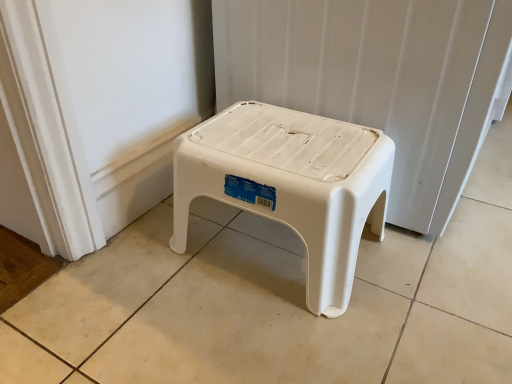
Find the location of a particular element. The image size is (512, 384). white plastic stool at center is located at coordinates (291, 185).

Describe the element at coordinates (291, 185) in the screenshot. I see `white plastic stool at center` at that location.

What is the approximate height of white plastic stool at center?

The height of white plastic stool at center is 9.86 inches.

The height and width of the screenshot is (384, 512). What do you see at coordinates (379, 80) in the screenshot?
I see `white plastic stool at center` at bounding box center [379, 80].

At what (x,y) coordinates should I click in order to perform the action: click on white plastic stool at center. Please return your answer as a coordinate pair (x, y). The image size is (512, 384). Looking at the image, I should click on (379, 80).

What is the approximate width of white plastic stool at center?

white plastic stool at center is 25.77 inches wide.

The image size is (512, 384). In order to click on white plastic stool at center in this screenshot , I will do `click(291, 185)`.

Which object is positioned more to the right, white plastic stool at center or white plastic stool at center?

white plastic stool at center.

Does white plastic stool at center come behind white plastic stool at center?

Yes, white plastic stool at center is further from the viewer.

Does point (453, 141) lie behind point (269, 203)?

Yes, point (453, 141) is behind point (269, 203).

From the picture: From the image's perspective, which is above, white plastic stool at center or white plastic stool at center?

From the image's view, white plastic stool at center is above.

From a real-world perspective, is white plastic stool at center under white plastic stool at center?

No.

Considering the sizes of white plastic stool at center and white plastic stool at center in the image, is white plastic stool at center wider or thinner than white plastic stool at center?

Considering their sizes, white plastic stool at center looks broader than white plastic stool at center.

Considering the sizes of white plastic stool at center and white plastic stool at center in the image, is white plastic stool at center taller or shorter than white plastic stool at center?

In the image, white plastic stool at center appears to be taller than white plastic stool at center.

Who is smaller, white plastic stool at center or white plastic stool at center?

Smaller between the two is white plastic stool at center.

Is white plastic stool at center not within white plastic stool at center?

Indeed, white plastic stool at center is completely outside white plastic stool at center.

Are white plastic stool at center and white plastic stool at center beside each other?

They are not placed beside each other.

Is white plastic stool at center aimed at white plastic stool at center?

No, white plastic stool at center is not turned towards white plastic stool at center.

Find the location of a particular element. This screenshot has height=384, width=512. radiator above the white plastic stool at center (from a real-world perspective) is located at coordinates tap(379, 80).

Between white plastic stool at center and white plastic stool at center, which one appears on the left side from the viewer's perspective?

Positioned to the left is white plastic stool at center.

Which object is further away from the camera taking this photo, white plastic stool at center or white plastic stool at center?

Positioned behind is white plastic stool at center.

Which point is more forward, (262, 118) or (391, 69)?

The point (391, 69) is more forward.

From the image's perspective, is white plastic stool at center above or below white plastic stool at center?

white plastic stool at center is below white plastic stool at center.

From a real-world perspective, is white plastic stool at center positioned above or below white plastic stool at center?

In terms of real-world spatial position, white plastic stool at center is below white plastic stool at center.

Looking at their sizes, would you say white plastic stool at center is wider or thinner than white plastic stool at center?

Considering their sizes, white plastic stool at center looks slimmer than white plastic stool at center.

Considering the sizes of white plastic stool at center and white plastic stool at center in the image, is white plastic stool at center taller or shorter than white plastic stool at center?

Considering their sizes, white plastic stool at center has less height than white plastic stool at center.

Can you confirm if white plastic stool at center is smaller than white plastic stool at center?

Yes.

Is white plastic stool at center not inside white plastic stool at center?

Yes, white plastic stool at center is located beyond the bounds of white plastic stool at center.

Would you say white plastic stool at center is a long distance from white plastic stool at center?

Actually, white plastic stool at center and white plastic stool at center are a little close together.

Is white plastic stool at center turned away from white plastic stool at center?

That's not correct — white plastic stool at center is not looking away from white plastic stool at center.

How many degrees apart are the facing directions of white plastic stool at center and white plastic stool at center?

0.81 degrees separate the facing orientations of white plastic stool at center and white plastic stool at center.

At what (x,y) coordinates should I click in order to perform the action: click on stool located underneath the white plastic stool at center (from a real-world perspective). Please return your answer as a coordinate pair (x, y). This screenshot has height=384, width=512. Looking at the image, I should click on (291, 185).

I want to click on stool located on the left of white plastic stool at center, so click(291, 185).

This screenshot has height=384, width=512. In order to click on stool located in front of the white plastic stool at center in this screenshot , I will do `click(291, 185)`.